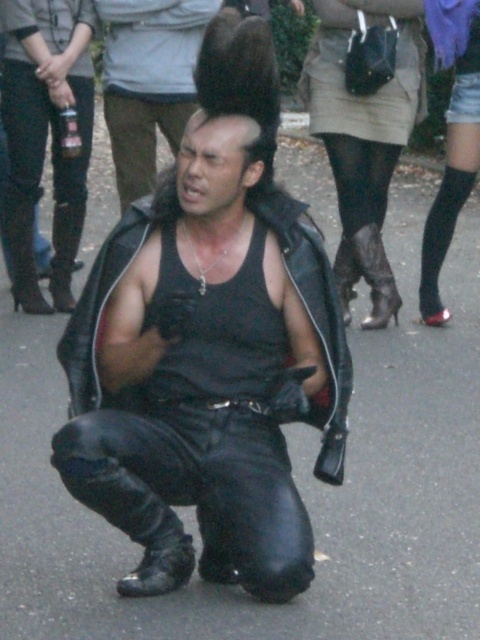
In the scene shown: Who is more distant from viewer, (206, 326) or (396, 86)?

The point (396, 86) is more distant.

Between leather jacket at center and black leather jacket at center, which one has more height?

black leather jacket at center

Between point (157, 424) and point (311, 118), which one is positioned behind?

Point (311, 118)

Where is `leather jacket at center`? leather jacket at center is located at coordinates (204, 374).

Who is more distant from viewer, (383,246) or (63,310)?

Positioned behind is point (63,310).

Is point (397, 305) positioned after point (63, 305)?

No, it is not.

The height and width of the screenshot is (640, 480). I want to click on leather at lower center, so click(375, 276).

Is black leather jacket at center positioned in front of black leather boot at lower left?

Yes, black leather jacket at center is in front of black leather boot at lower left.

Who is positioned more to the right, black leather jacket at center or black leather boot at lower left?

black leather jacket at center

The image size is (480, 640). What are the coordinates of `black leather jacket at center` in the screenshot? It's located at (363, 138).